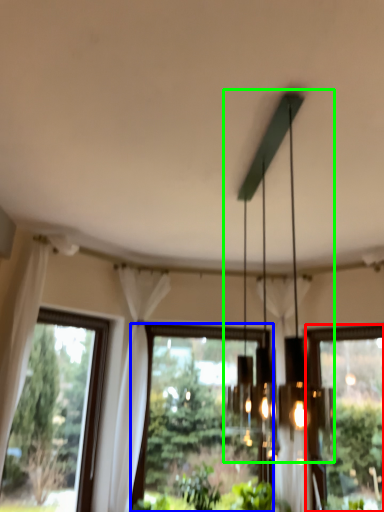
Question: Which is farther away from window (highlighted by a red box)? window (highlighted by a blue box) or chandelier (highlighted by a green box)?

Choices:
 (A) window
 (B) chandelier

Answer: (B)